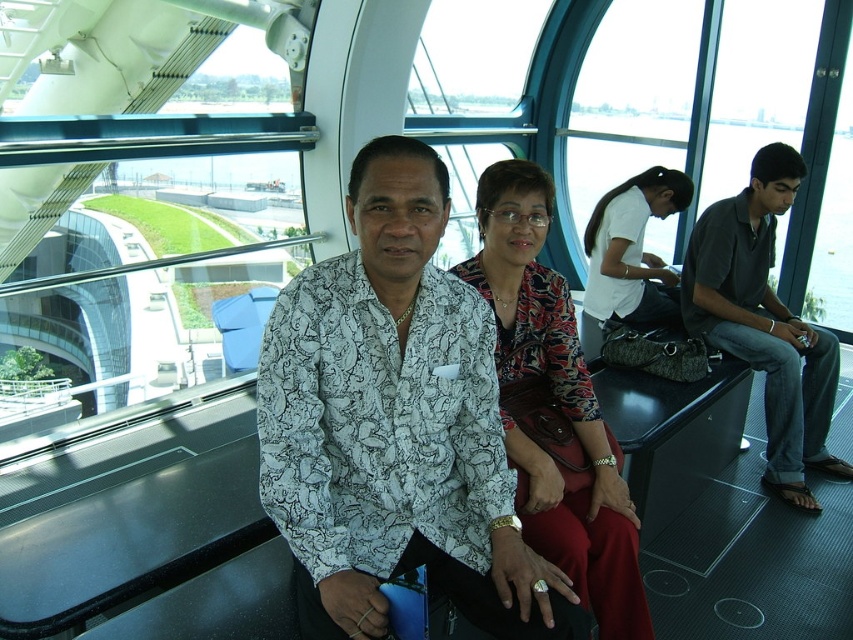
Which is more to the left, printed fabric shirt at center or dark gray shirt at right?

Positioned to the left is printed fabric shirt at center.

Does printed fabric shirt at center appear on the left side of dark gray shirt at right?

Indeed, printed fabric shirt at center is positioned on the left side of dark gray shirt at right.

What do you see at coordinates (395, 424) in the screenshot? I see `printed fabric shirt at center` at bounding box center [395, 424].

You are a GUI agent. You are given a task and a screenshot of the screen. Output one action in this format:
    pyautogui.click(x=<x>, y=<y>)
    Task: Click on the printed fabric shirt at center
    The image size is (853, 640).
    Given the screenshot: What is the action you would take?
    pyautogui.click(x=395, y=424)

Is printed fabric blouse at center below white matte shirt at center?

Yes, printed fabric blouse at center is below white matte shirt at center.

Does printed fabric blouse at center have a greater height compared to white matte shirt at center?

Correct, printed fabric blouse at center is much taller as white matte shirt at center.

Find the location of `printed fabric blouse at center`. printed fabric blouse at center is located at coordinates tap(553, 406).

Locate an element on the screen. printed fabric blouse at center is located at coordinates (553, 406).

Does printed fabric shirt at center have a greater height compared to white matte shirt at center?

Yes, printed fabric shirt at center is taller than white matte shirt at center.

Who is more forward, (450, 576) or (680, 189)?

Point (450, 576)

Locate an element on the screen. printed fabric shirt at center is located at coordinates (395, 424).